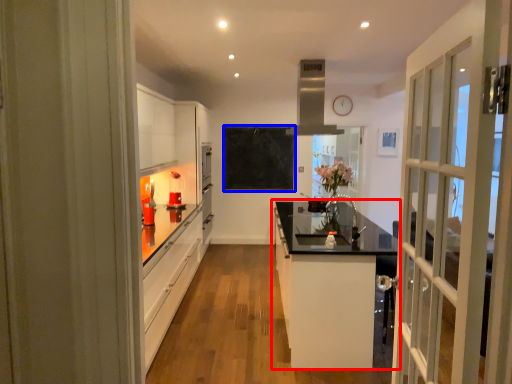
Question: Which object appears farthest to the camera in this image, cabinetry (highlighted by a red box) or bulletin board (highlighted by a blue box)?

Choices:
 (A) cabinetry
 (B) bulletin board

Answer: (B)